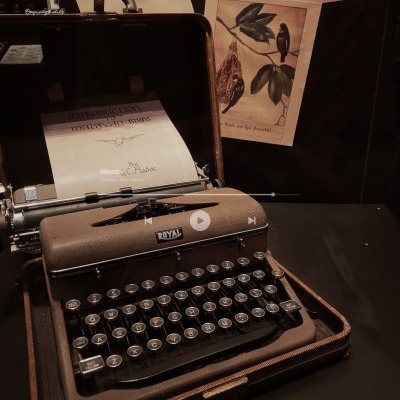
Find the location of a particular element. The image size is (400, 400). rectangular key on the typewriter is located at coordinates (92, 365).